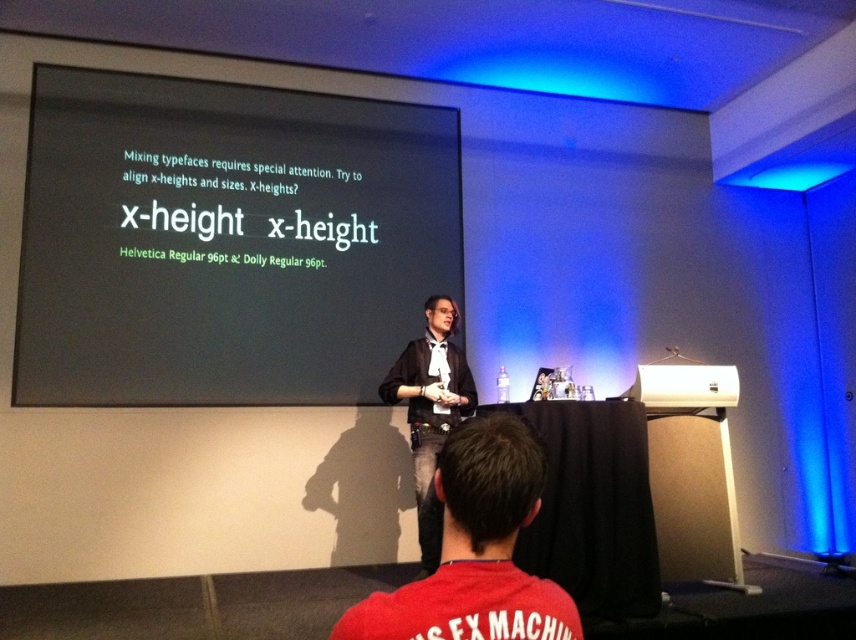
You are setting up for a presentation and need to ensure the white plastic projector at center can project onto the black matte projection screen at upper center. Given their sizes, will the projector be able to cover the entire screen?

The black matte projection screen at upper center is much taller than the white plastic projector at center. Since the screen is significantly taller, the projector might not be able to cover the entire height of the screen, potentially leaving parts of the screen unlit or out of focus.

Based on the photo, you are attending a presentation about typography and notice a point marked on the screen at coordinates (x=128, y=396). The speaker is standing to your right. If you want to point directly at that coordinate without moving your head, should you aim to your left or right side?

The point at (x=128, y=396) is 14.27 feet from the viewer, so you should aim to your right side because the speaker is on your right and the point is on the screen which is likely positioned to the speaker s right, meaning your right side aligns with the screen s right where the coordinate is located.